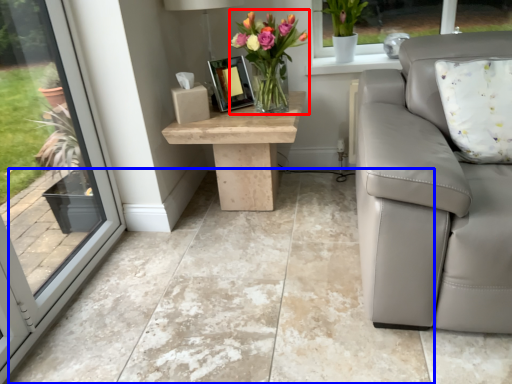
Question: Which object appears farthest to the camera in this image, floral arrangement (highlighted by a red box) or concrete (highlighted by a blue box)?

Choices:
 (A) floral arrangement
 (B) concrete

Answer: (A)